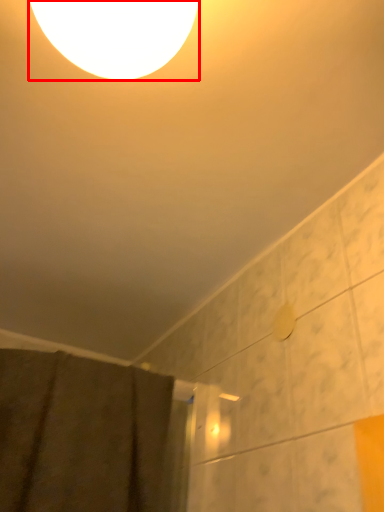
Question: Observing the image, what is the correct spatial positioning of lamp (annotated by the red box) in reference to shower curtain?

Choices:
 (A) left
 (B) right

Answer: (B)